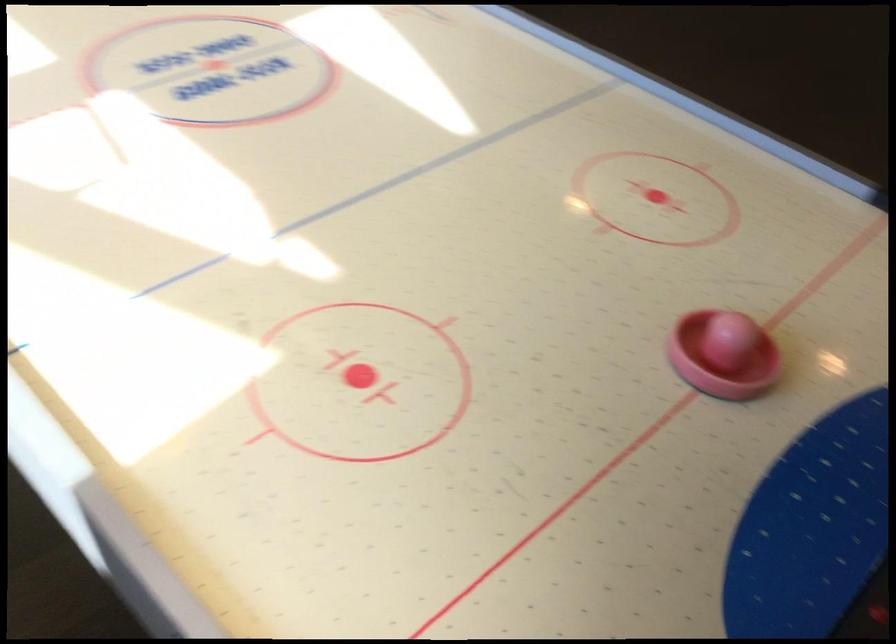
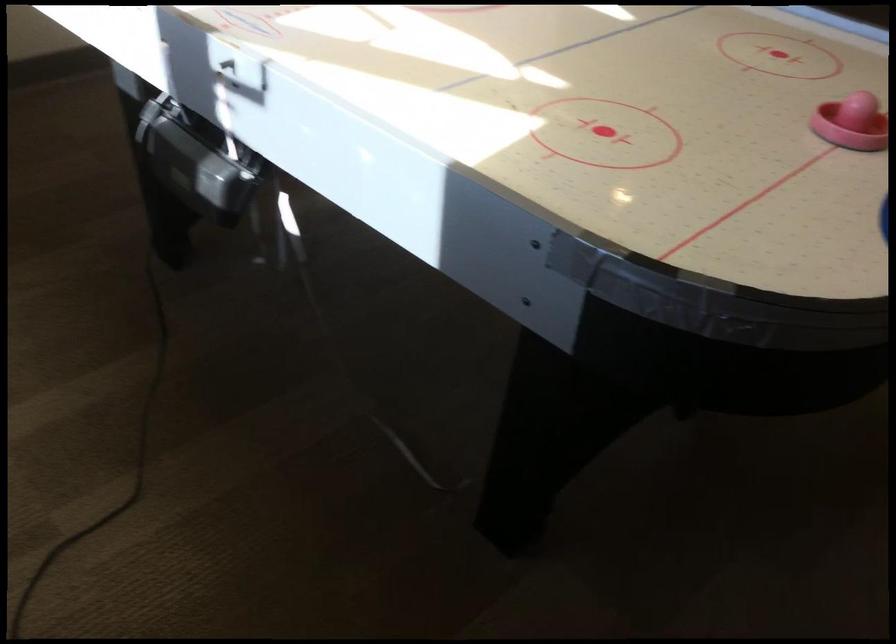
The images are taken continuously from a first-person perspective. In which direction are you moving?

The cameraman moved toward left, backward.